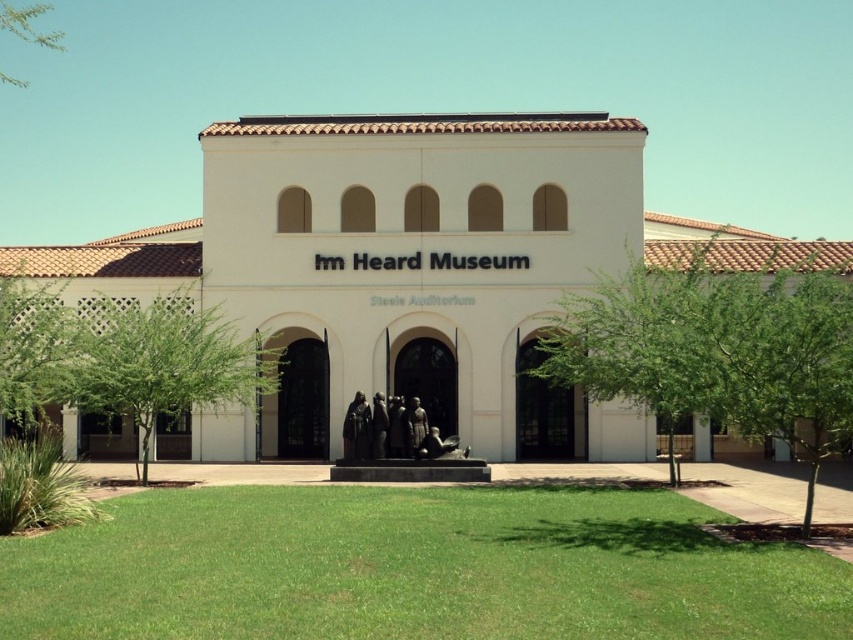
Is point (695, 362) in front of point (27, 305)?

Yes, point (695, 362) is in front of point (27, 305).

Is green leafy tree at center in front of green leafy tree at left?

Yes, green leafy tree at center is closer to the viewer.

Does point (624, 337) come closer to viewer compared to point (32, 426)?

Yes, point (624, 337) is in front of point (32, 426).

Locate an element on the screen. green leafy tree at center is located at coordinates (717, 349).

Is green leafy tree at lower left closer to camera compared to green leafy tree at left?

No.

Can you confirm if green leafy tree at lower left is positioned to the right of green leafy tree at left?

Indeed, green leafy tree at lower left is positioned on the right side of green leafy tree at left.

Between point (138, 472) and point (74, 348), which one is positioned behind?

Point (138, 472)

What are the coordinates of `green leafy tree at lower left` in the screenshot? It's located at (163, 362).

Can you confirm if green grass at lower center is smaller than green leafy tree at lower left?

Yes.

Can you confirm if green grass at lower center is thinner than green leafy tree at lower left?

Incorrect, green grass at lower center's width is not less than green leafy tree at lower left's.

Who is more distant from viewer, [202,564] or [219,403]?

The point [219,403] is more distant.

Locate an element on the screen. The height and width of the screenshot is (640, 853). green grass at lower center is located at coordinates (415, 568).